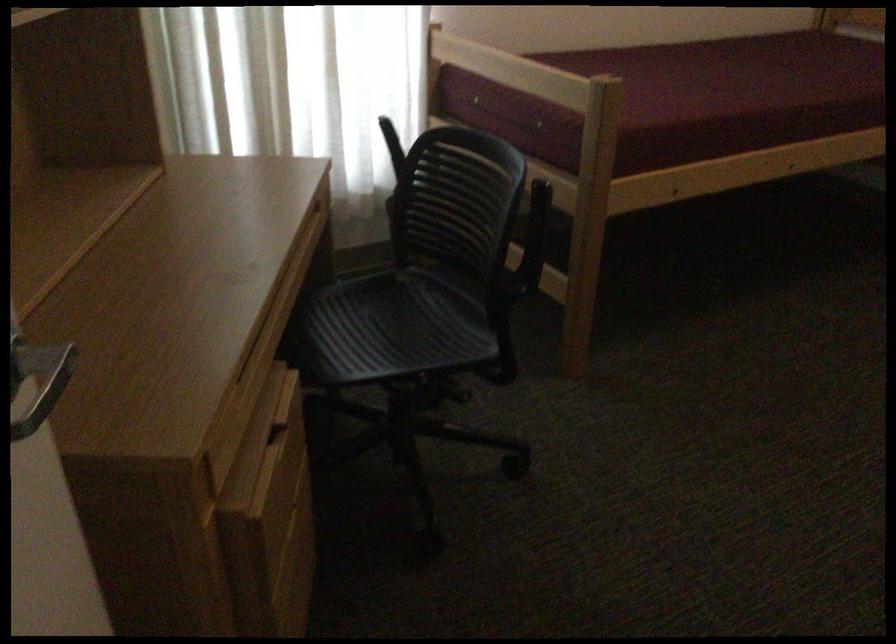
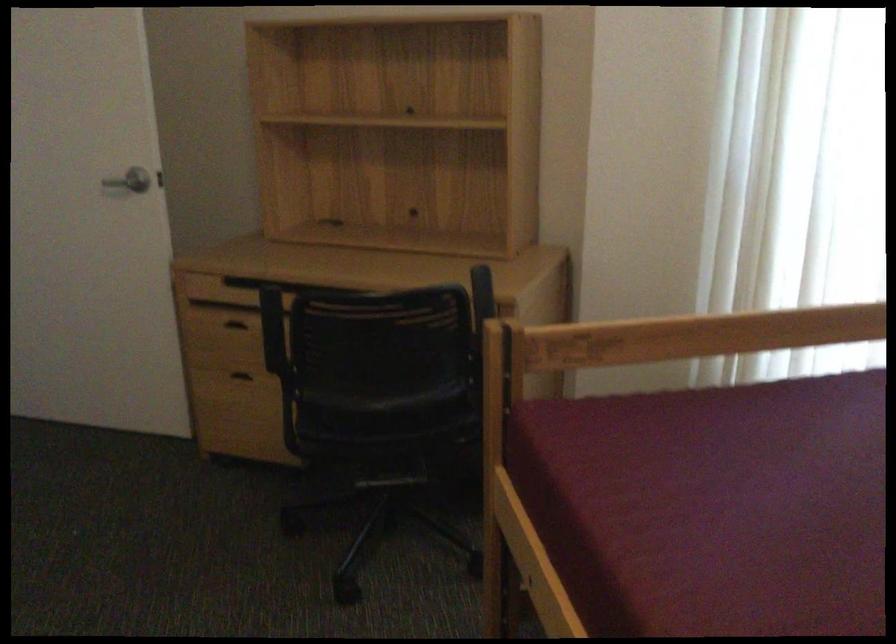
Locate, in the second image, the point that corresponds to point 252,478 in the first image.

(240, 323)